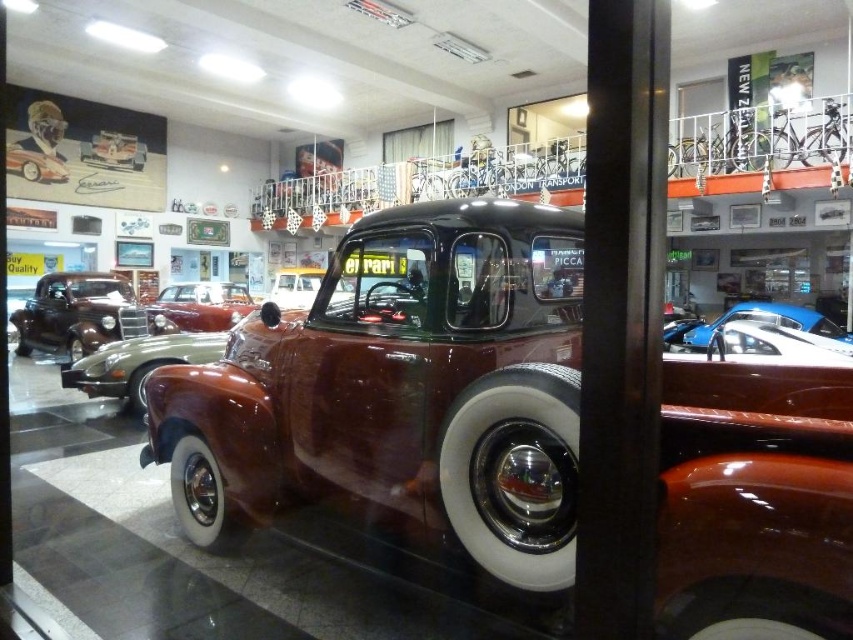
You are a photographer setting up a shoot in the showroom. You want to take a photo of the shiny silver car at center without any other vehicles blocking it. Is the shiny brown car at left currently in a position that might block your shot?

The shiny brown car at left is positioned under the shiny silver car at center, so it is directly below and would not block the view of the shiny silver car at center from the front or sides. You can take the photo without any obstruction.

You are a photographer planning to take a photo of the shiny maroon car at center and the shiny silver car at center in the showroom. If your camera frame can only accommodate vehicles up to the width of the wider car, which car should you focus on to ensure both fit in the frame?

The shiny silver car at center is wider than the shiny maroon car at center. To ensure both fit in the frame, focus on the shiny silver car at center since its width matches the camera frame limit, allowing the narrower shiny maroon car at center to also fit.

You are a photographer standing at the entrance of the showroom. You want to take a photo of the shiny brown car at left without including the classic pickup truck in the frame. Is it possible to do so given the current setup?

The shiny brown car at left is 35.28 feet away from the camera. Since the classic pickup truck is in the foreground, it might block the view of the shiny brown car at left. However, the distance suggests the car is far back, so adjusting the angle or moving sideways could allow capturing the shiny brown car at left without the truck in the frame.